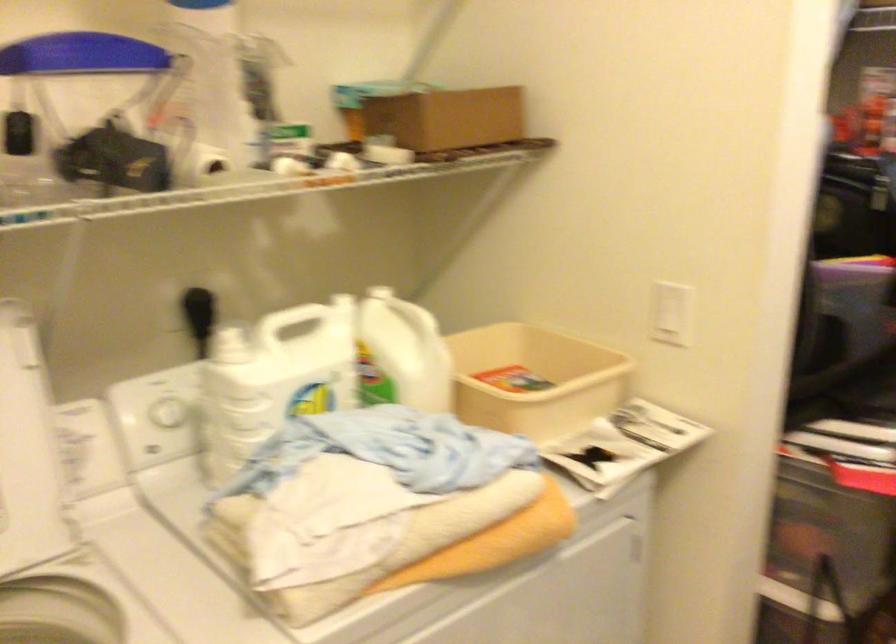
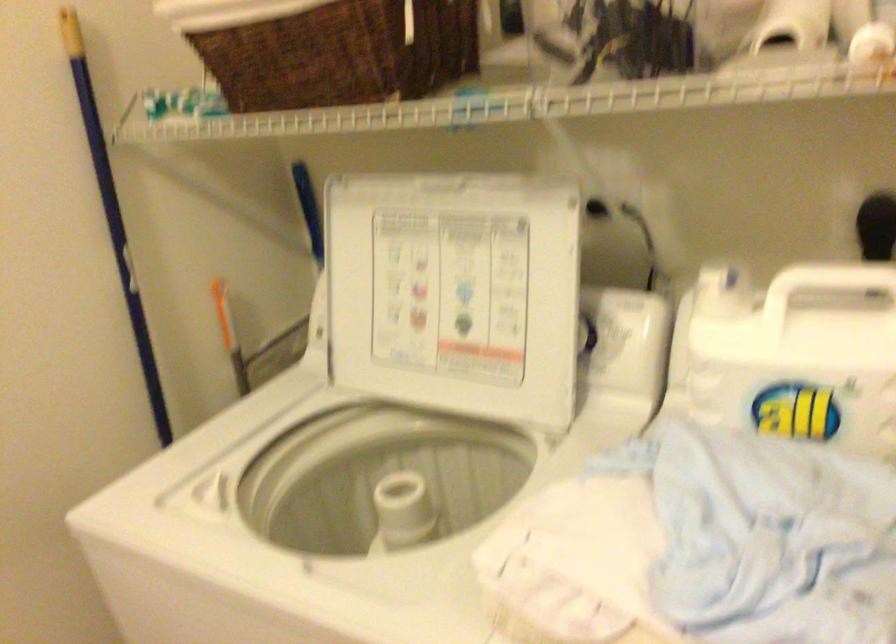
First-person continuous shooting, in which direction is the camera rotating?

The camera's rotation is toward left-down.